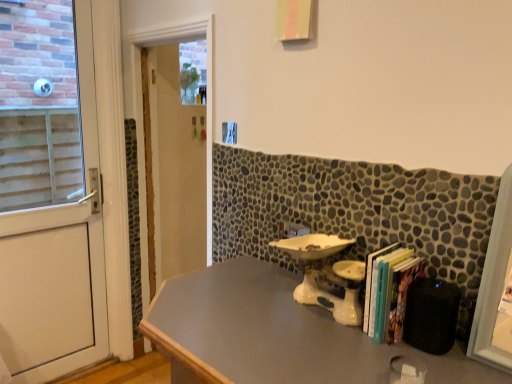
You are a GUI agent. You are given a task and a screenshot of the screen. Output one action in this format:
    pyautogui.click(x=<x>, y=<y>)
    Task: Click on the free space to the left of white ceramic sink at center
    
    Given the screenshot: What is the action you would take?
    pyautogui.click(x=241, y=303)